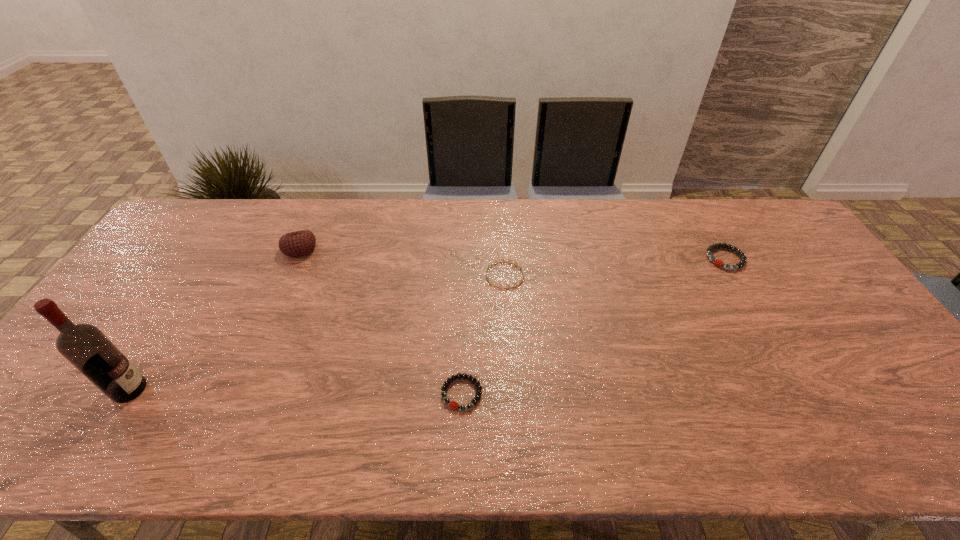
Locate an element on the screen. free space at the far left corner is located at coordinates (195, 238).

The width and height of the screenshot is (960, 540). Find the location of `blank area at the near left corner`. blank area at the near left corner is located at coordinates click(24, 430).

Locate an element on the screen. Image resolution: width=960 pixels, height=540 pixels. free region at the far right corner of the desktop is located at coordinates (758, 239).

The width and height of the screenshot is (960, 540). Find the location of `vacant point located between the alcohol and the second bracelet from right to left`. vacant point located between the alcohol and the second bracelet from right to left is located at coordinates (318, 332).

Where is `vacant area that lies between the tallest bracelet and the fourth object from right to left`? The image size is (960, 540). vacant area that lies between the tallest bracelet and the fourth object from right to left is located at coordinates (513, 254).

Where is `free spot between the fourth object from left to right and the nearest bracelet`? Image resolution: width=960 pixels, height=540 pixels. free spot between the fourth object from left to right and the nearest bracelet is located at coordinates (484, 334).

Where is `unoccupied position between the rightmost object and the second object from right to left`? The height and width of the screenshot is (540, 960). unoccupied position between the rightmost object and the second object from right to left is located at coordinates (615, 267).

At what (x,y) coordinates should I click in order to perform the action: click on vacant area that lies between the tallest bracelet and the fourth object from right to left. Please return your answer as a coordinate pair (x, y). This screenshot has width=960, height=540. Looking at the image, I should click on (513, 254).

What are the coordinates of `vacant area between the leftmost object and the second object from right to left` in the screenshot? It's located at (318, 332).

Identify the location of free space between the beanbag and the third object from right to left. Image resolution: width=960 pixels, height=540 pixels. (381, 321).